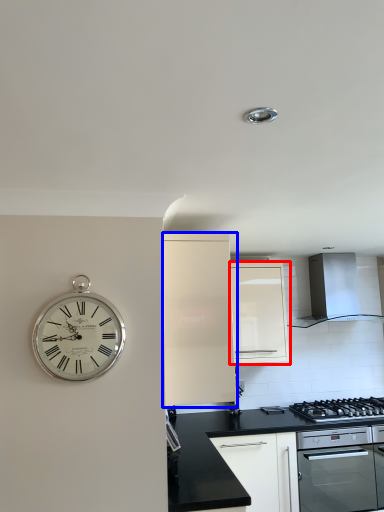
Question: Which object is further to the camera taking this photo, cabinetry (highlighted by a red box) or cabinetry (highlighted by a blue box)?

Choices:
 (A) cabinetry
 (B) cabinetry

Answer: (A)